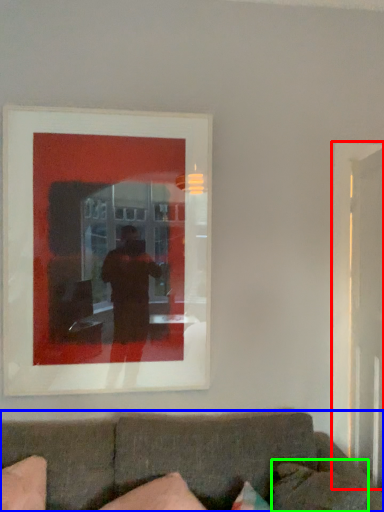
Question: Considering the real-world distances, which object is closest to glass door (highlighted by a red box)? studio couch (highlighted by a blue box) or pillow (highlighted by a green box).

Choices:
 (A) studio couch
 (B) pillow

Answer: (B)